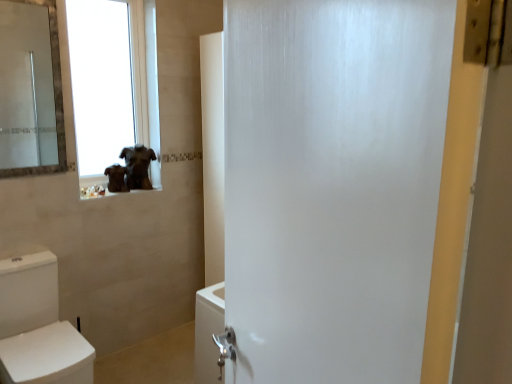
Question: Is brown fur dog at upper left, the first animal viewed from the left, thinner than transparent glass window at upper left?

Choices:
 (A) yes
 (B) no

Answer: (B)

Question: Is brown fur dog at upper left, the first animal viewed from the left, oriented away from transparent glass window at upper left?

Choices:
 (A) no
 (B) yes

Answer: (B)

Question: Can you confirm if brown fur dog at upper left, which is counted as the second animal, starting from the right, is bigger than transparent glass window at upper left?

Choices:
 (A) yes
 (B) no

Answer: (B)

Question: Is brown fur dog at upper left, which is counted as the second animal, starting from the right, completely or partially outside of transparent glass window at upper left?

Choices:
 (A) no
 (B) yes

Answer: (B)

Question: Considering the relative sizes of brown fur dog at upper left, the first animal viewed from the left, and transparent glass window at upper left in the image provided, is brown fur dog at upper left, the first animal viewed from the left, smaller than transparent glass window at upper left?

Choices:
 (A) yes
 (B) no

Answer: (A)

Question: Are brown fur dog at upper left, which is counted as the second animal, starting from the right, and transparent glass window at upper left far apart?

Choices:
 (A) no
 (B) yes

Answer: (B)

Question: Does white glossy toilet at lower left have a lesser height compared to brown matte statue at upper left, the second animal positioned from the left?

Choices:
 (A) no
 (B) yes

Answer: (A)

Question: Is brown matte statue at upper left, marked as the 1th animal in a right-to-left arrangement, surrounded by white glossy toilet at lower left?

Choices:
 (A) yes
 (B) no

Answer: (B)

Question: Is white glossy toilet at lower left positioned with its back to brown matte statue at upper left, the second animal positioned from the left?

Choices:
 (A) no
 (B) yes

Answer: (A)

Question: Can you confirm if white glossy toilet at lower left is smaller than brown matte statue at upper left, the second animal positioned from the left?

Choices:
 (A) yes
 (B) no

Answer: (B)

Question: From a real-world perspective, is white glossy toilet at lower left positioned under brown matte statue at upper left, marked as the 1th animal in a right-to-left arrangement, based on gravity?

Choices:
 (A) yes
 (B) no

Answer: (A)

Question: Is white glossy toilet at lower left to the left of brown matte statue at upper left, marked as the 1th animal in a right-to-left arrangement, from the viewer's perspective?

Choices:
 (A) yes
 (B) no

Answer: (A)

Question: From the image's perspective, is transparent glass window at upper left under brown matte statue at upper left, marked as the 1th animal in a right-to-left arrangement?

Choices:
 (A) no
 (B) yes

Answer: (A)